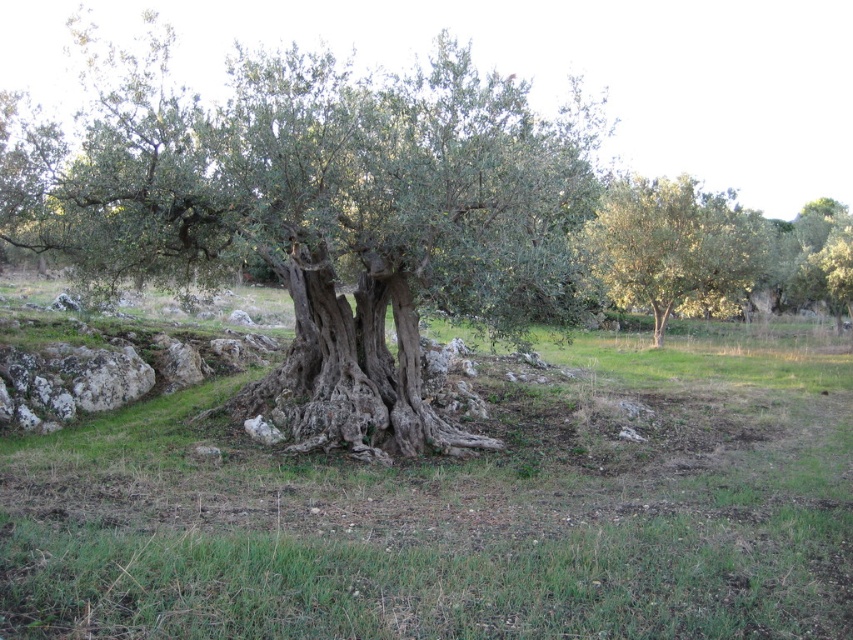
Question: Which is nearer to the green leafy tree at center?

Choices:
 (A) green rough bark tree at center
 (B) green grassy at center

Answer: (B)

Question: Is green grassy at center positioned behind green rough bark tree at center?

Choices:
 (A) no
 (B) yes

Answer: (A)

Question: Is green grassy at center positioned at the back of green rough bark tree at center?

Choices:
 (A) yes
 (B) no

Answer: (B)

Question: Which point is farther to the camera?

Choices:
 (A) (253, 67)
 (B) (152, 589)
 (C) (636, 230)

Answer: (C)

Question: Which of the following is the closest to the observer?

Choices:
 (A) green leafy tree at center
 (B) green grassy at center

Answer: (B)

Question: Observing the image, what is the correct spatial positioning of green grassy at center in reference to green leafy tree at center?

Choices:
 (A) above
 (B) below

Answer: (B)